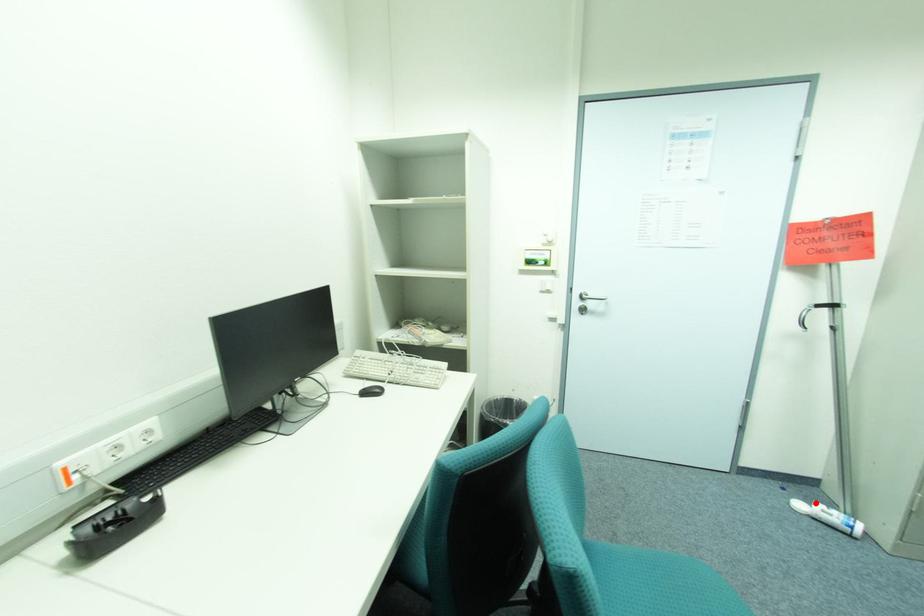
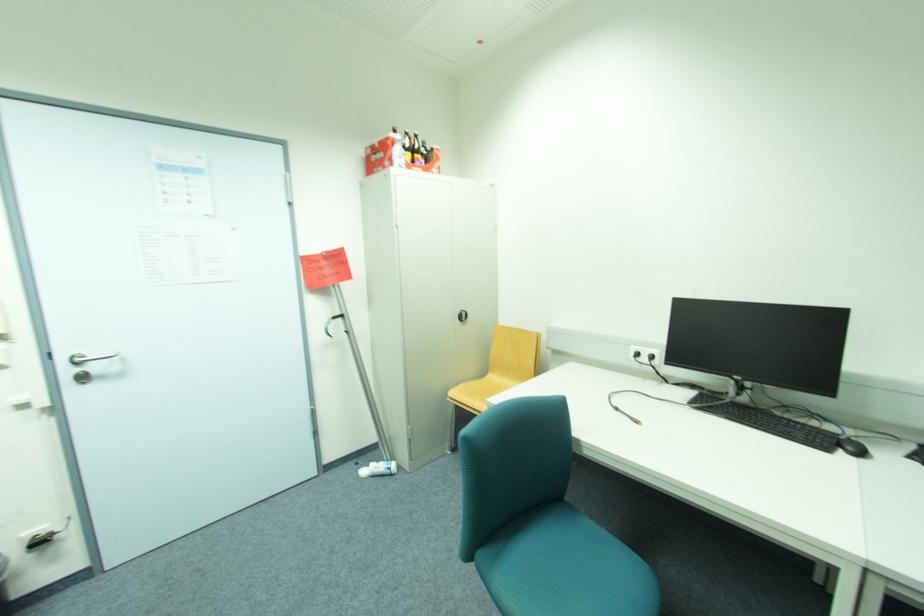
Question: I am providing you with two images of the same scene from different viewpoints. Image1 has a red point marked. In image2, the corresponding 3D location appears at what relative position? Reply with the corresponding letter.

Choices:
 (A) Closer
 (B) Farther

Answer: (B)